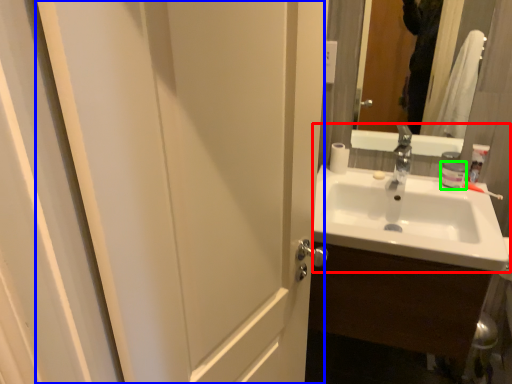
Question: Estimate the real-world distances between objects in this image. Which object is farther from sink (highlighted by a red box), screen door (highlighted by a blue box) or toiletry (highlighted by a green box)?

Choices:
 (A) screen door
 (B) toiletry

Answer: (A)